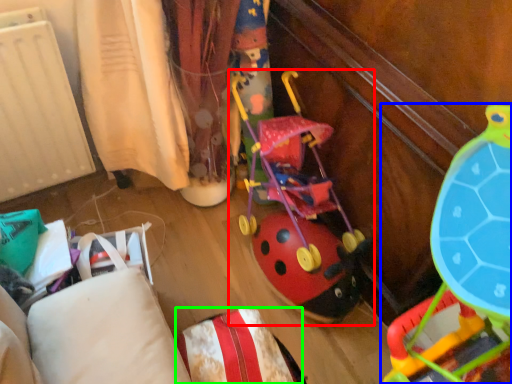
Question: Which object is the closest to the toy (highlighted by a red box)? Choose among these: toy (highlighted by a blue box) or pillow (highlighted by a green box).

Choices:
 (A) toy
 (B) pillow

Answer: (A)